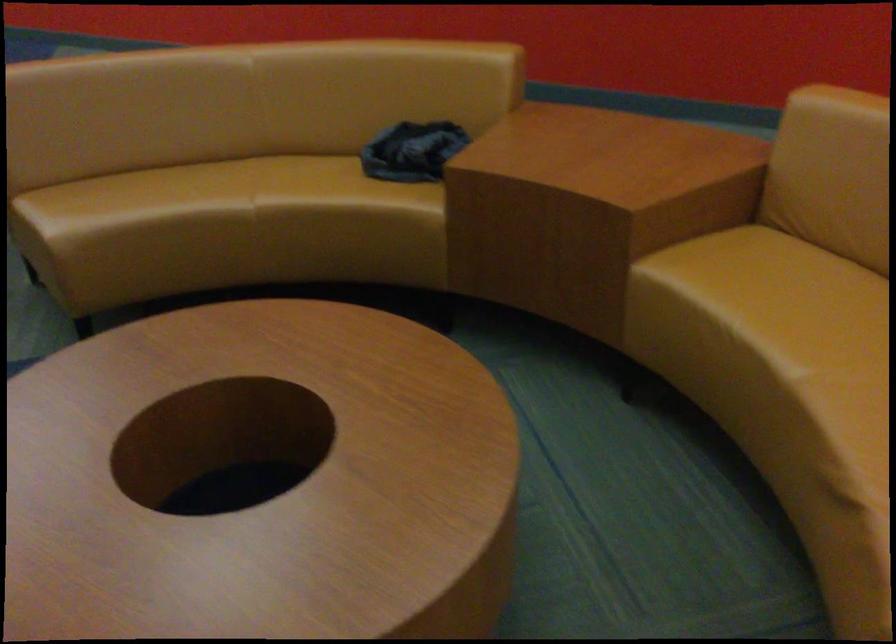
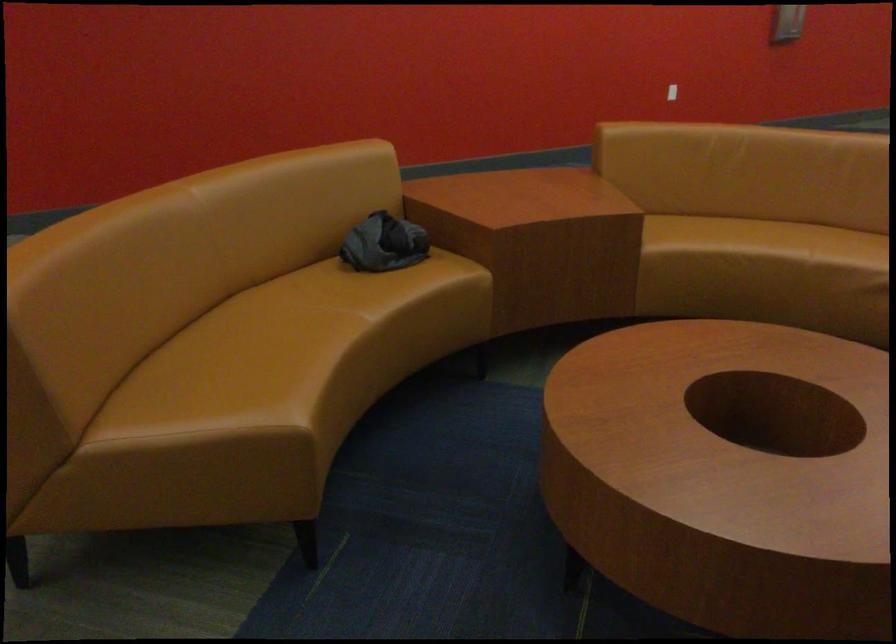
In the second image, find the point that corresponds to [734,292] in the first image.

(719, 242)